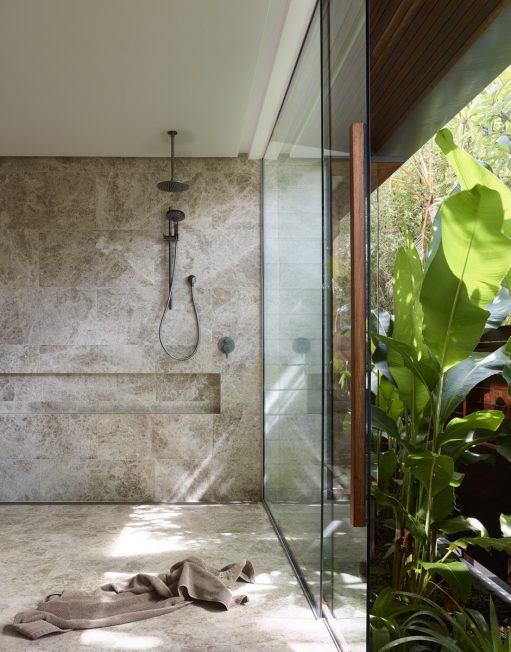
Locate an element on the screen. The height and width of the screenshot is (652, 511). shower head bar is located at coordinates (172, 166).